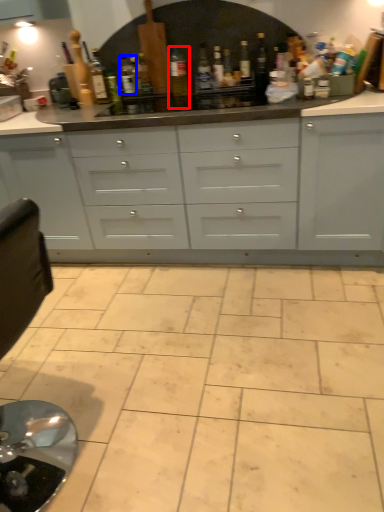
Question: Which object appears farthest to the camera in this image, bottle (highlighted by a red box) or bottle (highlighted by a blue box)?

Choices:
 (A) bottle
 (B) bottle

Answer: (B)